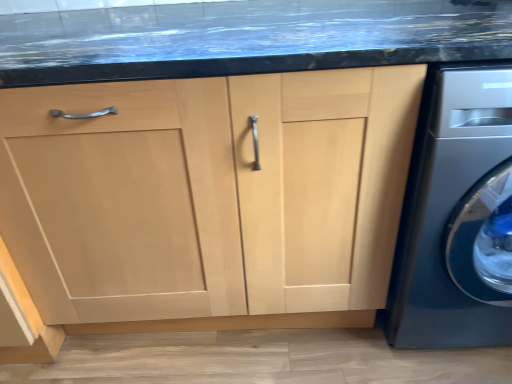
Question: Is natural wood cabinet at center positioned beyond the bounds of satin silver washing machine at lower right?

Choices:
 (A) yes
 (B) no

Answer: (A)

Question: Is natural wood cabinet at center bigger than satin silver washing machine at lower right?

Choices:
 (A) yes
 (B) no

Answer: (A)

Question: From the image's perspective, is natural wood cabinet at center beneath satin silver washing machine at lower right?

Choices:
 (A) yes
 (B) no

Answer: (A)

Question: From a real-world perspective, is natural wood cabinet at center physically below satin silver washing machine at lower right?

Choices:
 (A) yes
 (B) no

Answer: (A)

Question: Is the position of natural wood cabinet at center more distant than that of satin silver washing machine at lower right?

Choices:
 (A) no
 (B) yes

Answer: (B)

Question: Is natural wood cabinet at center at the right side of satin silver washing machine at lower right?

Choices:
 (A) no
 (B) yes

Answer: (A)

Question: Does satin silver washing machine at lower right come in front of natural wood cabinet at center?

Choices:
 (A) yes
 (B) no

Answer: (A)

Question: Considering the relative positions of satin silver washing machine at lower right and natural wood cabinet at center in the image provided, is satin silver washing machine at lower right to the right of natural wood cabinet at center from the viewer's perspective?

Choices:
 (A) yes
 (B) no

Answer: (A)

Question: Is satin silver washing machine at lower right not inside natural wood cabinet at center?

Choices:
 (A) yes
 (B) no

Answer: (A)

Question: From the image's perspective, would you say satin silver washing machine at lower right is shown under natural wood cabinet at center?

Choices:
 (A) no
 (B) yes

Answer: (A)

Question: Is satin silver washing machine at lower right shorter than natural wood cabinet at center?

Choices:
 (A) no
 (B) yes

Answer: (A)

Question: Does satin silver washing machine at lower right have a lesser width compared to natural wood cabinet at center?

Choices:
 (A) no
 (B) yes

Answer: (A)

Question: Based on their sizes in the image, would you say satin silver washing machine at lower right is bigger or smaller than natural wood cabinet at center?

Choices:
 (A) small
 (B) big

Answer: (A)